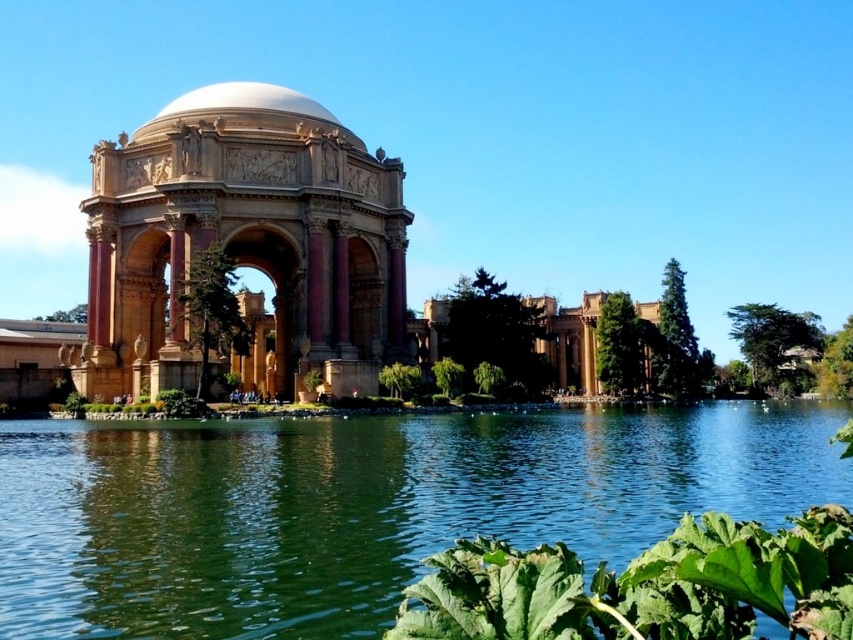
Question: Is green liquid water at center bigger than golden stone gazebo at center?

Choices:
 (A) yes
 (B) no

Answer: (B)

Question: Which point is closer to the camera taking this photo?

Choices:
 (A) (323, 125)
 (B) (155, 314)

Answer: (B)

Question: Which object is positioned closest to the golden stone gazebo at center?

Choices:
 (A) green liquid water at center
 (B) white marble dome at upper center

Answer: (B)

Question: Is green liquid water at center to the left of golden stone gazebo at center from the viewer's perspective?

Choices:
 (A) no
 (B) yes

Answer: (A)

Question: Can you confirm if golden stone gazebo at center is positioned above white marble dome at upper center?

Choices:
 (A) no
 (B) yes

Answer: (A)

Question: Among these points, which one is farthest from the camera?

Choices:
 (A) [22, 564]
 (B) [294, 104]

Answer: (B)